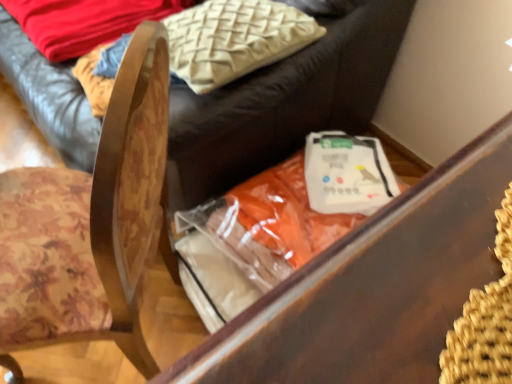
Question: From the image's perspective, is beige textured pillow at upper center below wooden chair at center?

Choices:
 (A) yes
 (B) no

Answer: (B)

Question: Are beige textured pillow at upper center and wooden chair at center far apart?

Choices:
 (A) no
 (B) yes

Answer: (A)

Question: Can you confirm if beige textured pillow at upper center is taller than wooden chair at center?

Choices:
 (A) no
 (B) yes

Answer: (A)

Question: From the image's perspective, is beige textured pillow at upper center on top of wooden chair at center?

Choices:
 (A) no
 (B) yes

Answer: (B)

Question: Does beige textured pillow at upper center have a larger size compared to wooden chair at center?

Choices:
 (A) no
 (B) yes

Answer: (A)

Question: In the image, is orange fabric bag at center, which is counted as the second furniture, starting from the top, positioned in front of or behind wooden chair at center?

Choices:
 (A) front
 (B) behind

Answer: (B)

Question: Would you say orange fabric bag at center, arranged as the 1th furniture when ordered from the bottom, is inside or outside wooden chair at center?

Choices:
 (A) outside
 (B) inside

Answer: (A)

Question: Is orange fabric bag at center, arranged as the 1th furniture when ordered from the bottom, to the left or to the right of wooden chair at center in the image?

Choices:
 (A) left
 (B) right

Answer: (B)

Question: From the image's perspective, is orange fabric bag at center, arranged as the 1th furniture when ordered from the bottom, above or below wooden chair at center?

Choices:
 (A) above
 (B) below

Answer: (B)

Question: Is beige textured pillow at upper center wider or thinner than wooden chair at center?

Choices:
 (A) thin
 (B) wide

Answer: (A)

Question: From the image's perspective, is beige textured pillow at upper center located above or below wooden chair at center?

Choices:
 (A) above
 (B) below

Answer: (A)

Question: Do you think beige textured pillow at upper center is within wooden chair at center, or outside of it?

Choices:
 (A) inside
 (B) outside

Answer: (B)

Question: From a real-world perspective, relative to wooden chair at center, is beige textured pillow at upper center vertically above or below?

Choices:
 (A) below
 (B) above

Answer: (B)

Question: From the image's perspective, relative to orange fabric bag at center, which is counted as the second furniture, starting from the top, is beige textured pillow at upper center above or below?

Choices:
 (A) above
 (B) below

Answer: (A)

Question: Is beige textured pillow at upper center bigger or smaller than orange fabric bag at center, which is counted as the second furniture, starting from the top?

Choices:
 (A) small
 (B) big

Answer: (A)